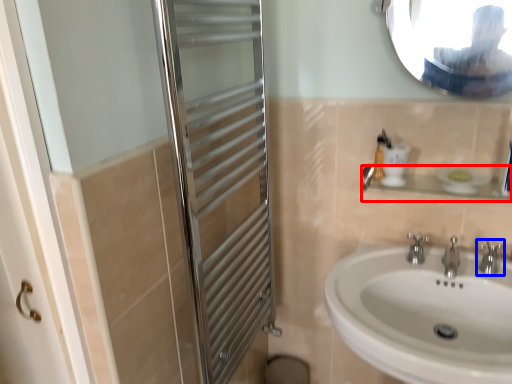
Question: Which of the following is the farthest to the observer, balustrade (highlighted by a red box) or tap (highlighted by a blue box)?

Choices:
 (A) balustrade
 (B) tap

Answer: (B)